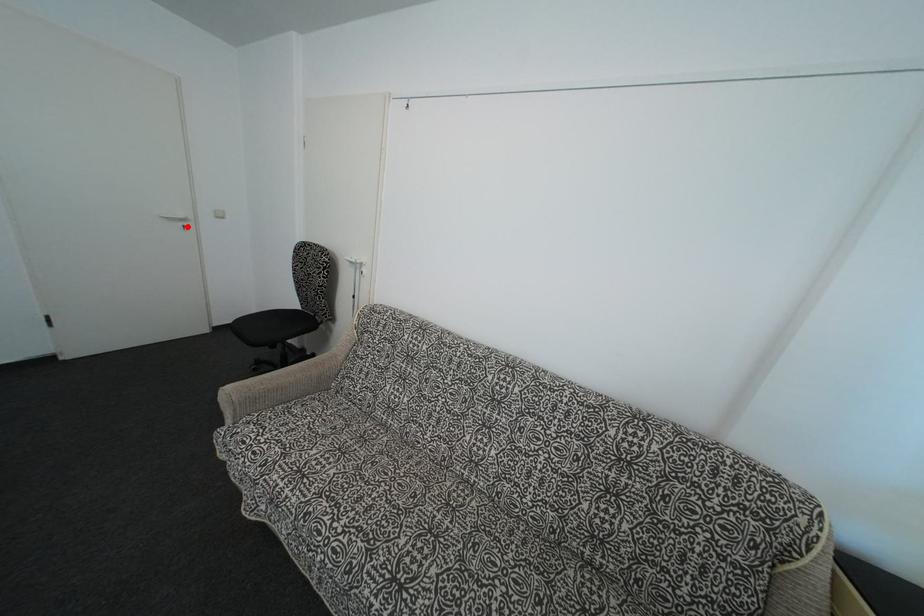
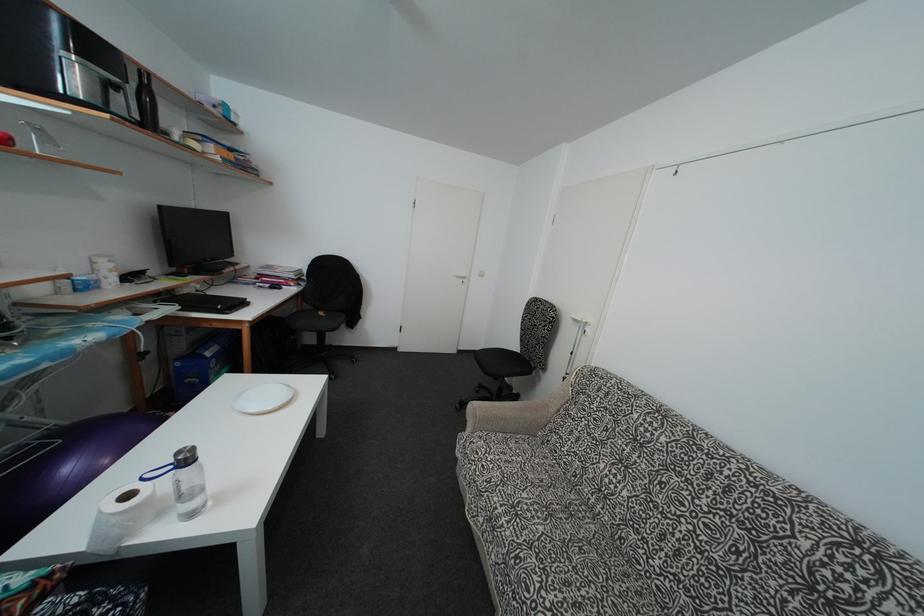
Where in the second image is the point corresponding to the highlighted location from the first image?

(468, 284)